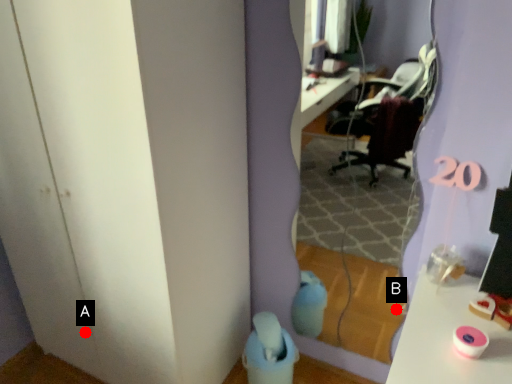
Question: Two points are circled on the image, labeled by A and B beside each circle. Which point appears farthest from the camera in this image?

Choices:
 (A) A is further
 (B) B is further

Answer: (B)